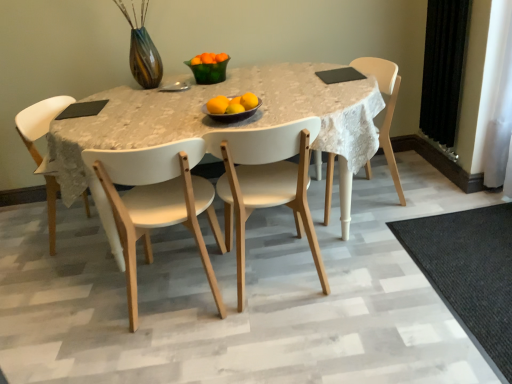
Question: Considering the relative sizes of yellow matte/orange at center, which appears as the fifth orange when viewed from the back, and orange matte at center, which ranks as the 1th orange in back-to-front order, in the image provided, is yellow matte/orange at center, which appears as the fifth orange when viewed from the back, thinner than orange matte at center, which ranks as the 1th orange in back-to-front order,?

Choices:
 (A) yes
 (B) no

Answer: (B)

Question: Can you confirm if yellow matte/orange at center, acting as the 2th orange starting from the front, is positioned to the right of orange matte at center, the sixth orange viewed from the front?

Choices:
 (A) yes
 (B) no

Answer: (A)

Question: Is yellow matte/orange at center, the 1th orange positioned from the bottom, not within orange matte at center, the sixth orange viewed from the front?

Choices:
 (A) no
 (B) yes

Answer: (B)

Question: Can you confirm if yellow matte/orange at center, which appears as the fifth orange when viewed from the back, is wider than orange matte at center, which ranks as the 1th orange in back-to-front order?

Choices:
 (A) no
 (B) yes

Answer: (B)

Question: Is yellow matte/orange at center, acting as the 2th orange starting from the front, bigger than orange matte at center, which is the sixth orange in bottom-to-top order?

Choices:
 (A) no
 (B) yes

Answer: (A)

Question: Is yellow matte/orange at center, the 1th orange positioned from the bottom, looking in the opposite direction of orange matte at center, marked as the first orange in a top-to-bottom arrangement?

Choices:
 (A) yes
 (B) no

Answer: (A)

Question: Is white matte chair at center, the second chair in the left-to-right sequence, outside orange matte at center, which is the fifth orange from front to back?

Choices:
 (A) yes
 (B) no

Answer: (A)

Question: From the image's perspective, does white matte chair at center, which ranks as the 3th chair in right-to-left order, appear higher than orange matte at center, which is the fifth orange from bottom to top?

Choices:
 (A) yes
 (B) no

Answer: (B)

Question: Is the depth of white matte chair at center, the second chair in the left-to-right sequence, greater than that of orange matte at center, which is the fifth orange from bottom to top?

Choices:
 (A) no
 (B) yes

Answer: (A)

Question: Considering the relative positions of white matte chair at center, the second chair in the left-to-right sequence, and orange matte at center, which is the fifth orange from bottom to top, in the image provided, is white matte chair at center, the second chair in the left-to-right sequence, to the left of orange matte at center, which is the fifth orange from bottom to top, from the viewer's perspective?

Choices:
 (A) no
 (B) yes

Answer: (B)

Question: Is white matte chair at center, which ranks as the 3th chair in right-to-left order, far from orange matte at center, which appears as the 2th orange when viewed from the back?

Choices:
 (A) yes
 (B) no

Answer: (A)

Question: From the image's perspective, is white matte chair at center, the second chair in the left-to-right sequence, beneath orange matte at center, which is the fifth orange from front to back?

Choices:
 (A) yes
 (B) no

Answer: (A)

Question: Is white matte chair at center, which ranks as the 3th chair in right-to-left order, positioned far away from white matte table at center?

Choices:
 (A) no
 (B) yes

Answer: (A)